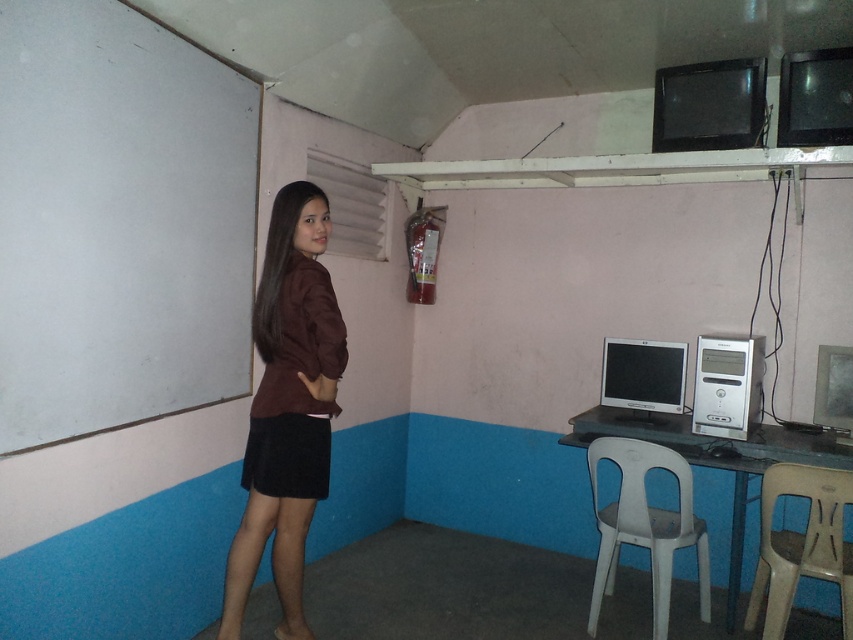
Which is behind, point (630, 440) or point (740, 374)?

The point (740, 374) is more distant.

What do you see at coordinates (645, 525) in the screenshot? The height and width of the screenshot is (640, 853). I see `white plastic chair at lower right` at bounding box center [645, 525].

Between point (593, 592) and point (704, 392), which one is positioned behind?

Point (704, 392)

The image size is (853, 640). What are the coordinates of `white plastic chair at lower right` in the screenshot? It's located at (645, 525).

Who is more distant from viewer, (627, 456) or (833, 365)?

The point (833, 365) is behind.

Between white plastic chair at lower right and matte black monitor at right, which one appears on the left side from the viewer's perspective?

Positioned to the left is white plastic chair at lower right.

Which is behind, point (672, 534) or point (833, 365)?

Point (833, 365)

Where is `white plastic chair at lower right`? This screenshot has height=640, width=853. white plastic chair at lower right is located at coordinates (645, 525).

Between white plastic table at lower right and matte silver monitor at center, which one has more height?

Standing taller between the two is white plastic table at lower right.

Is the position of white plastic table at lower right less distant than that of matte silver monitor at center?

Yes, it is.

I want to click on white plastic table at lower right, so click(x=717, y=460).